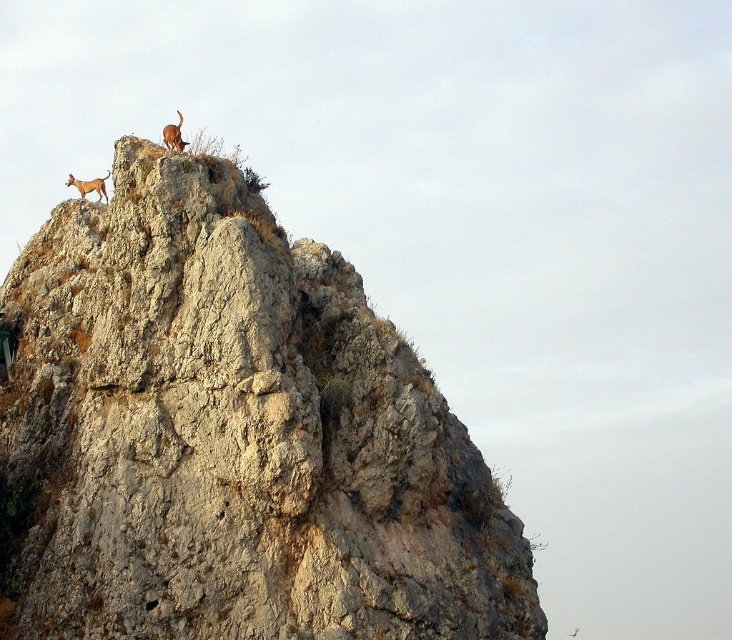
Who is shorter, rough textured rock at upper center or brown fur dog at upper center?

With less height is brown fur dog at upper center.

Does rough textured rock at upper center have a smaller size compared to brown fur dog at upper center?

No.

Which is behind, point (466, 451) or point (175, 148)?

The point (466, 451) is behind.

Where is `rough textured rock at upper center`? This screenshot has width=732, height=640. rough textured rock at upper center is located at coordinates (231, 436).

Does rough textured rock at upper center have a smaller size compared to brown fur dog at upper left?

No.

The image size is (732, 640). What do you see at coordinates (231, 436) in the screenshot?
I see `rough textured rock at upper center` at bounding box center [231, 436].

Who is more distant from viewer, (160,300) or (82,180)?

The point (82,180) is more distant.

Where is `rough textured rock at upper center`? rough textured rock at upper center is located at coordinates (231, 436).

Can you confirm if brown fur dog at upper left is bigger than brown fur dog at upper center?

No, brown fur dog at upper left is not bigger than brown fur dog at upper center.

From the picture: How far apart are brown fur dog at upper left and brown fur dog at upper center?

brown fur dog at upper left and brown fur dog at upper center are 24.93 meters apart.

Describe the element at coordinates (89, 186) in the screenshot. This screenshot has width=732, height=640. I see `brown fur dog at upper left` at that location.

The height and width of the screenshot is (640, 732). Identify the location of brown fur dog at upper left. (89, 186).